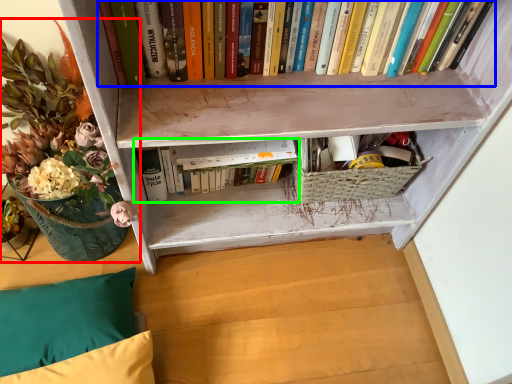
Question: Which is nearer to the floral arrangement (highlighted by a red box)? book (highlighted by a blue box) or book (highlighted by a green box).

Choices:
 (A) book
 (B) book

Answer: (B)